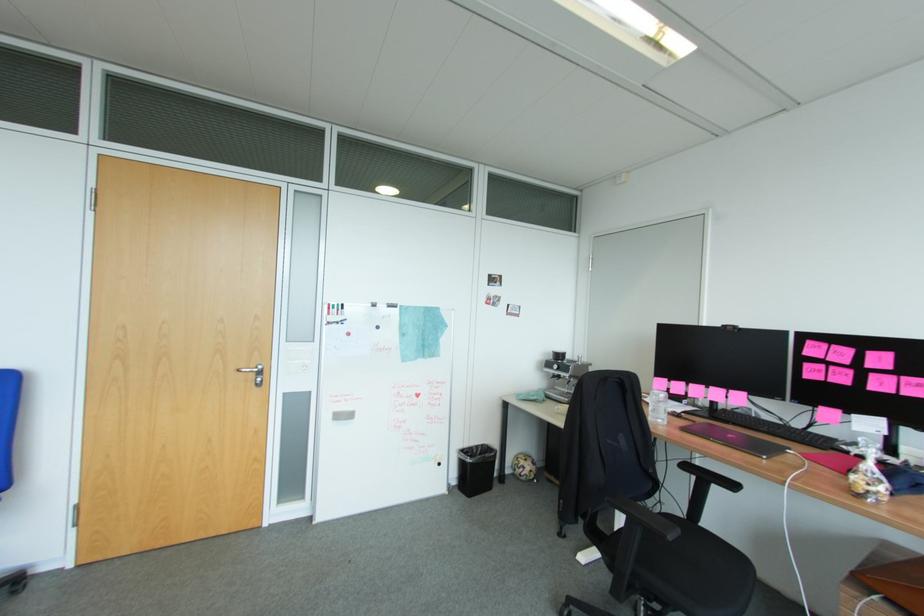
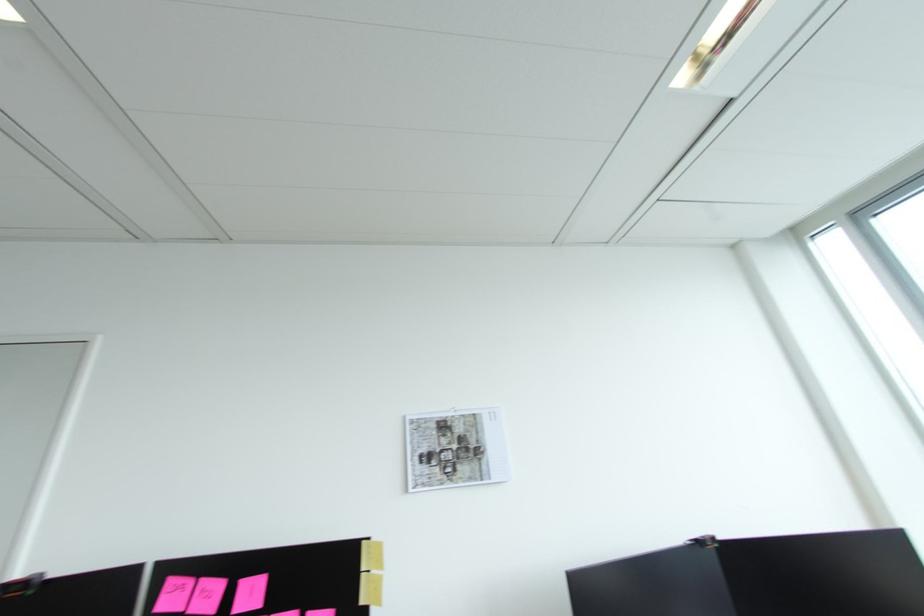
Where in the second image is the point corresponding to [815,342] from the first image?

(176, 582)